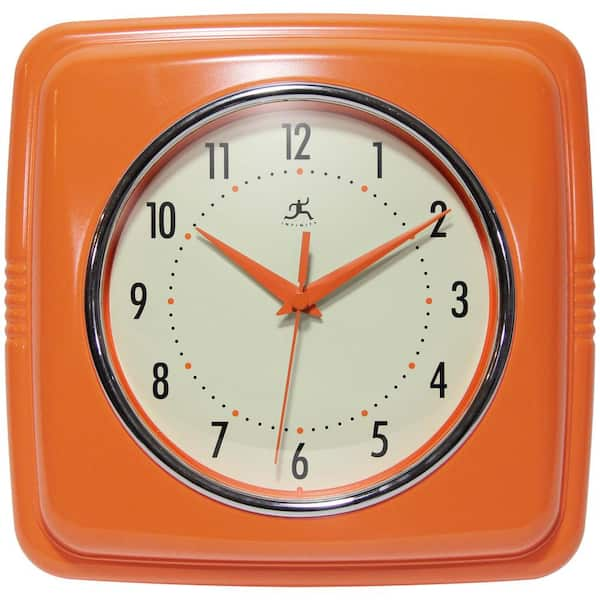
The height and width of the screenshot is (600, 600). Find the location of `orange retro clock`. orange retro clock is located at coordinates (97, 460).